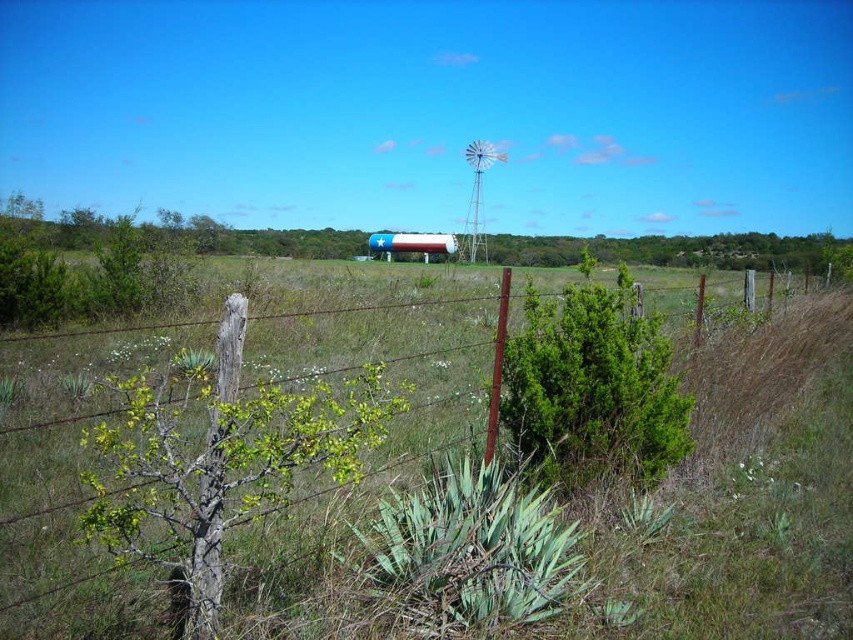
Is point (32, 628) closer to viewer compared to point (473, 244)?

Yes, point (32, 628) is closer to viewer.

Can you confirm if green grass at center is positioned to the right of white painted metal water tower at center?

Incorrect, green grass at center is not on the right side of white painted metal water tower at center.

Is point (798, 298) farther from viewer compared to point (477, 202)?

No.

The image size is (853, 640). I want to click on green grass at center, so click(x=756, y=486).

Is the position of green rough bark tree at center-left more distant than that of white painted metal water tower at center?

No.

Is point (115, 472) farther from camera compared to point (463, 244)?

No, (115, 472) is closer to viewer.

Measure the distance between green rough bark tree at center-left and camera.

green rough bark tree at center-left and camera are 9.13 feet apart.

Find the location of a particular element. Image resolution: width=853 pixels, height=640 pixels. green rough bark tree at center-left is located at coordinates (222, 464).

Does green grass at center have a greater height compared to green rough bark tree at center-left?

Yes.

Does green grass at center come in front of green rough bark tree at center-left?

That is False.

Does point (821, 497) come behind point (331, 426)?

Yes, point (821, 497) is farther from viewer.

Where is `green grass at center`? green grass at center is located at coordinates (756, 486).